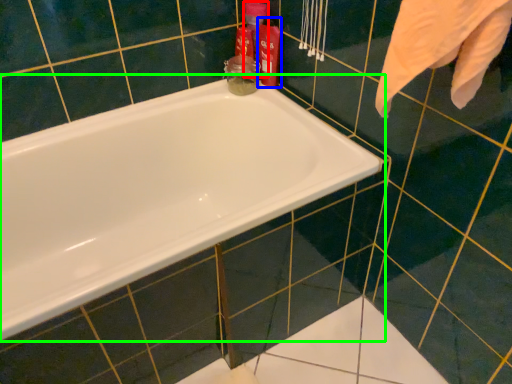
Question: Which object is positioned farthest from cleaning product (highlighted by a red box)? Select from cleaning product (highlighted by a blue box) and bathtub (highlighted by a green box).

Choices:
 (A) cleaning product
 (B) bathtub

Answer: (B)